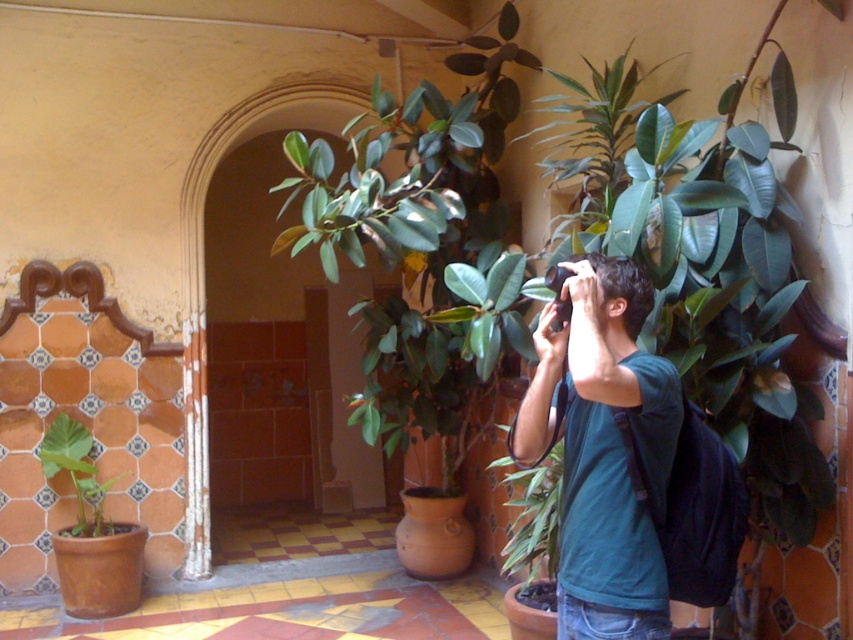
Is point (521, 561) in front of point (102, 518)?

Yes, it is.

Is point (529, 477) in front of point (68, 531)?

Yes, point (529, 477) is in front of point (68, 531).

Where is `green leafy plant at center`? green leafy plant at center is located at coordinates (531, 515).

Which is behind, point (567, 499) or point (561, 461)?

The point (561, 461) is behind.

At what (x,y) coordinates should I click in order to perform the action: click on green matte shirt at center. Please return your answer as a coordinate pair (x, y). Looking at the image, I should click on (604, 449).

Who is shorter, green matte shirt at center or green matte leafy plant at lower left?

Standing shorter between the two is green matte leafy plant at lower left.

Who is higher up, green matte shirt at center or green matte leafy plant at lower left?

Positioned higher is green matte shirt at center.

Is point (544, 317) closer to viewer compared to point (97, 484)?

Yes.

The width and height of the screenshot is (853, 640). In order to click on green matte shirt at center in this screenshot , I will do pos(604,449).